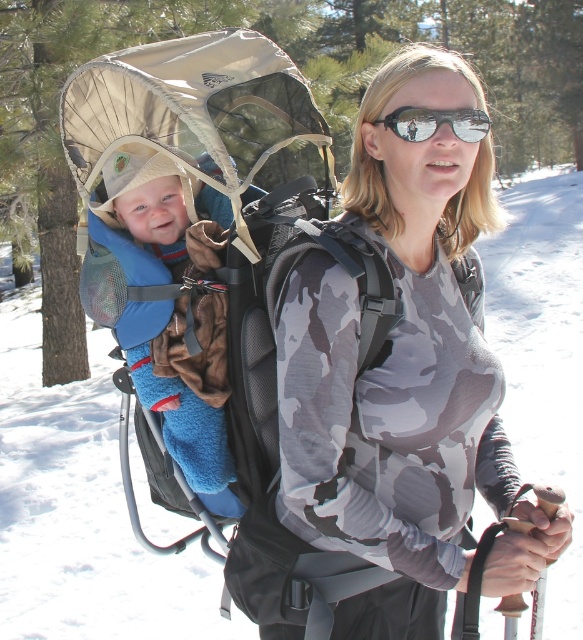
Question: Observing the image, what is the correct spatial positioning of camouflage fabric shirt at center in reference to sunglasses at center?

Choices:
 (A) above
 (B) below

Answer: (B)

Question: Which object appears closest to the camera in this image?

Choices:
 (A) camouflage fabric shirt at center
 (B) sunglasses at center

Answer: (A)

Question: Can you confirm if camouflage fabric shirt at center is positioned to the left of sunglasses at center?

Choices:
 (A) yes
 (B) no

Answer: (B)

Question: Which point is closer to the camera?

Choices:
 (A) (458, 225)
 (B) (430, 131)

Answer: (B)

Question: Can you confirm if camouflage fabric shirt at center is wider than sunglasses at center?

Choices:
 (A) no
 (B) yes

Answer: (B)